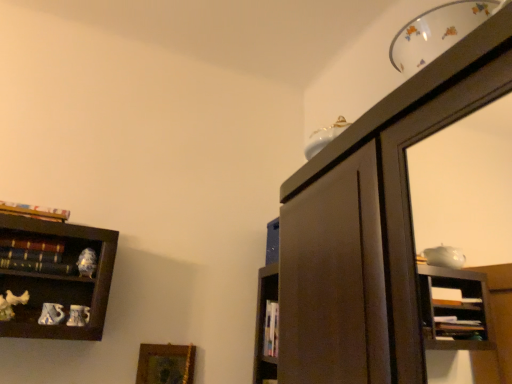
Question: Is hardcover books at left, positioned as the 1th book in bottom-to-top order, positioned in front of hardcover book at upper left, which is the 2th book from bottom to top?

Choices:
 (A) yes
 (B) no

Answer: (A)

Question: Is hardcover books at left, the 2th book when ordered from top to bottom, bigger than hardcover book at upper left, which is the 2th book from bottom to top?

Choices:
 (A) yes
 (B) no

Answer: (B)

Question: From the image's perspective, would you say hardcover books at left, positioned as the 1th book in bottom-to-top order, is positioned over hardcover book at upper left, which is the 2th book from bottom to top?

Choices:
 (A) no
 (B) yes

Answer: (A)

Question: Considering the relative positions of hardcover books at left, the 2th book when ordered from top to bottom, and hardcover book at upper left, positioned as the first book in top-to-bottom order, in the image provided, is hardcover books at left, the 2th book when ordered from top to bottom, to the left of hardcover book at upper left, positioned as the first book in top-to-bottom order, from the viewer's perspective?

Choices:
 (A) no
 (B) yes

Answer: (A)

Question: From a real-world perspective, is hardcover books at left, positioned as the 1th book in bottom-to-top order, physically above hardcover book at upper left, positioned as the first book in top-to-bottom order?

Choices:
 (A) yes
 (B) no

Answer: (B)

Question: Considering the positions of point (12, 266) and point (53, 220), is point (12, 266) closer or farther from the camera than point (53, 220)?

Choices:
 (A) farther
 (B) closer

Answer: (B)

Question: In terms of height, does hardcover books at left, positioned as the 1th book in bottom-to-top order, look taller or shorter compared to hardcover book at upper left, positioned as the first book in top-to-bottom order?

Choices:
 (A) tall
 (B) short

Answer: (B)

Question: Looking at their shapes, would you say hardcover books at left, the 2th book when ordered from top to bottom, is wider or thinner than hardcover book at upper left, which is the 2th book from bottom to top?

Choices:
 (A) wide
 (B) thin

Answer: (B)

Question: From the image's perspective, is hardcover books at left, the 2th book when ordered from top to bottom, located above or below hardcover book at upper left, positioned as the first book in top-to-bottom order?

Choices:
 (A) above
 (B) below

Answer: (B)

Question: In terms of size, does hardcover books at left, positioned as the 1th book in bottom-to-top order, appear bigger or smaller than gold-framed picture at lower left?

Choices:
 (A) small
 (B) big

Answer: (A)

Question: Is point click(x=36, y=269) positioned closer to the camera than point click(x=140, y=380)?

Choices:
 (A) closer
 (B) farther

Answer: (A)

Question: Is hardcover books at left, the 2th book when ordered from top to bottom, in front of or behind gold-framed picture at lower left in the image?

Choices:
 (A) behind
 (B) front

Answer: (B)

Question: From a real-world perspective, is hardcover books at left, the 2th book when ordered from top to bottom, above or below gold-framed picture at lower left?

Choices:
 (A) above
 (B) below

Answer: (A)

Question: From their relative heights in the image, would you say hardcover book at upper left, positioned as the first book in top-to-bottom order, is taller or shorter than hardcover books at left, positioned as the 1th book in bottom-to-top order?

Choices:
 (A) short
 (B) tall

Answer: (B)

Question: Is hardcover book at upper left, which is the 2th book from bottom to top, bigger or smaller than hardcover books at left, positioned as the 1th book in bottom-to-top order?

Choices:
 (A) big
 (B) small

Answer: (A)